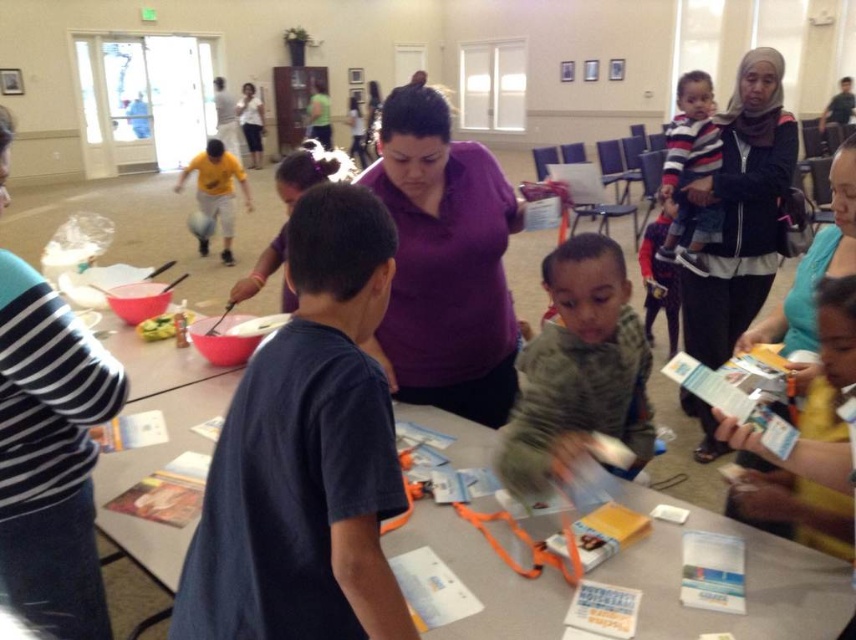
Please provide the exact coordinates of the gray knit sweater at center in the image.

The gray knit sweater at center is located at coordinates point (578, 371).